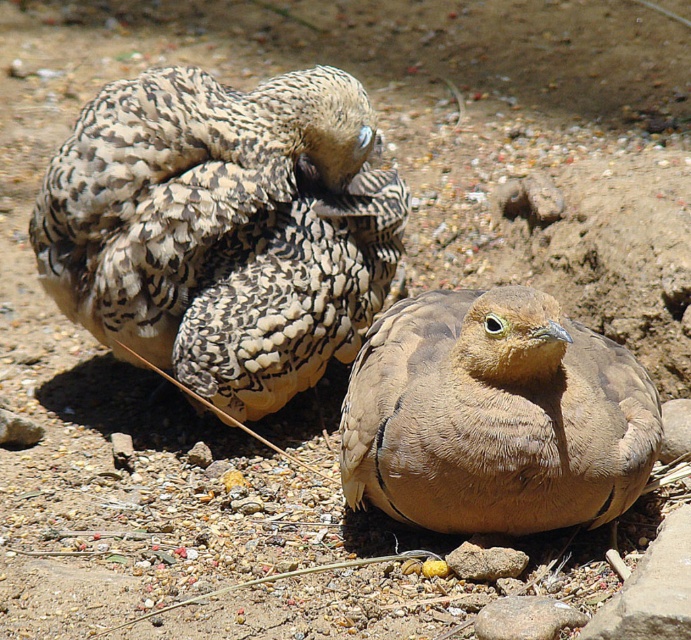
Is speckled feathers at center above brown feathered bird at center?

Indeed, speckled feathers at center is positioned over brown feathered bird at center.

Does speckled feathers at center have a lesser width compared to brown feathered bird at center?

Incorrect, speckled feathers at center's width is not less than brown feathered bird at center's.

Locate an element on the screen. speckled feathers at center is located at coordinates (223, 228).